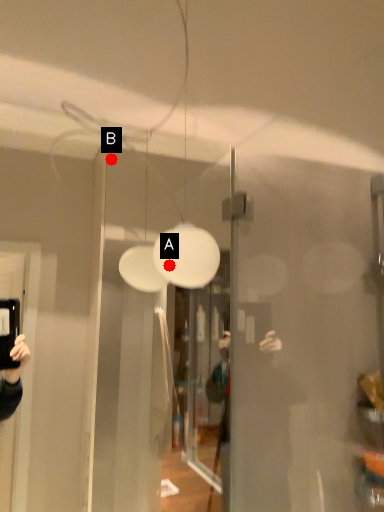
Question: Two points are circled on the image, labeled by A and B beside each circle. Which point appears closest to the camera in this image?

Choices:
 (A) A is closer
 (B) B is closer

Answer: (A)